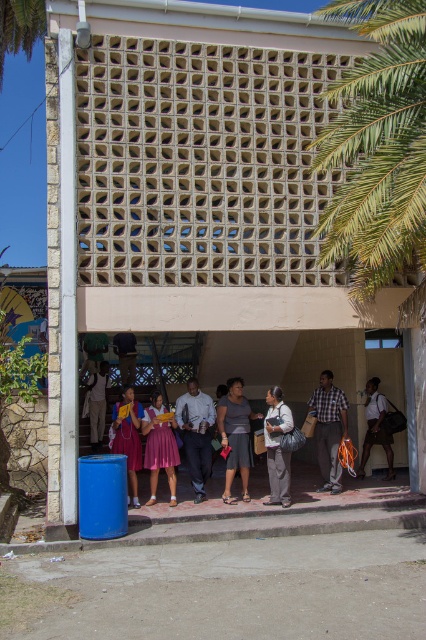
Question: Where is matte white shirt at center located in relation to green leafy palm tree at upper left in the image?

Choices:
 (A) right
 (B) left

Answer: (A)

Question: Which point is closer to the camera?

Choices:
 (A) plaid fabric shirt at center
 (B) matte black backpack at lower left
 (C) matte gray shorts at center
 (D) green leafy palm at upper right

Answer: (D)

Question: Observing the image, what is the correct spatial positioning of matte white shirt at center in reference to matte black backpack at left?

Choices:
 (A) right
 (B) left

Answer: (A)

Question: Considering the real-world distances, which object is farthest from the matte white shirt at center?

Choices:
 (A) green leafy palm at upper right
 (B) gray fabric jacket at center
 (C) brown leather backpack at right

Answer: (A)

Question: Which point is closer to the camera?

Choices:
 (A) pink satin dress at lower left
 (B) plaid fabric shirt at center
 (C) green leafy palm tree at upper left

Answer: (A)

Question: Does pink satin dress at center appear on the left side of brown leather backpack at right?

Choices:
 (A) no
 (B) yes

Answer: (B)